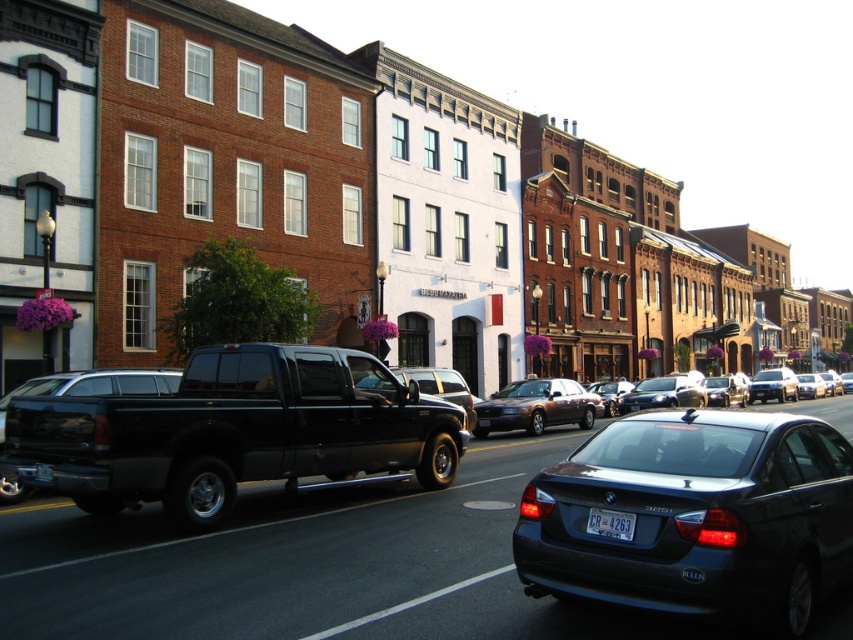
Question: From the image, what is the correct spatial relationship of black matte truck at center in relation to metallic brown sedan at center?

Choices:
 (A) above
 (B) below

Answer: (A)

Question: Can you confirm if metallic brown sedan at center is bigger than white plastic license plate at center?

Choices:
 (A) no
 (B) yes

Answer: (B)

Question: Which object is closer to the camera taking this photo?

Choices:
 (A) black matte truck at center
 (B) white plastic license plate at center

Answer: (B)

Question: Which point appears closest to the camera in this image?

Choices:
 (A) (120, 460)
 (B) (741, 461)
 (C) (619, 522)
 (D) (689, 388)

Answer: (C)

Question: Is black matte truck at center positioned in front of metallic brown sedan at center?

Choices:
 (A) no
 (B) yes

Answer: (B)

Question: Among these points, which one is farthest from the camera?

Choices:
 (A) (350, 436)
 (B) (599, 524)
 (C) (697, 536)
 (D) (689, 387)

Answer: (D)